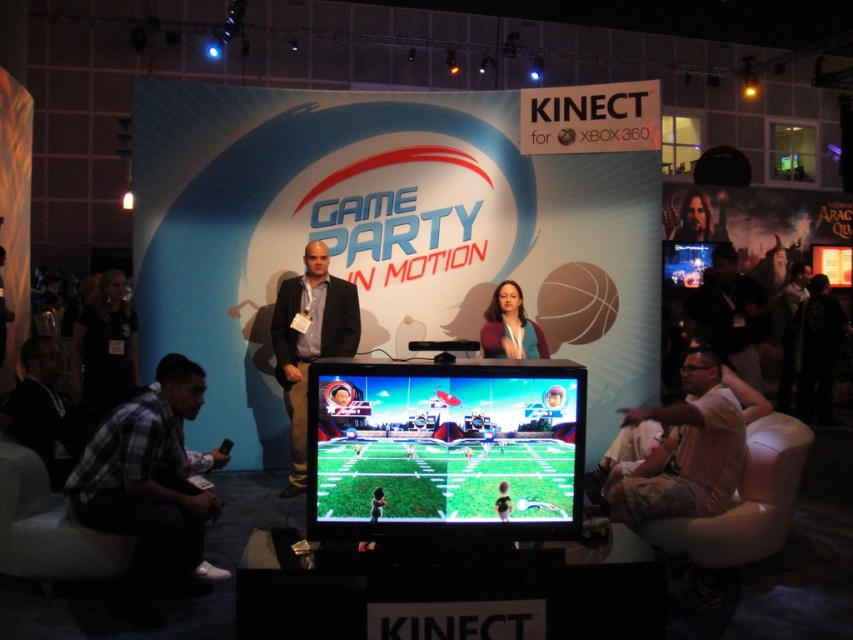
Can you confirm if matte black suit at center is taller than smooth skin face at upper right?

Correct, matte black suit at center is much taller as smooth skin face at upper right.

Who is positioned more to the left, matte black suit at center or smooth skin face at upper right?

Positioned to the left is matte black suit at center.

Locate an element on the screen. This screenshot has width=853, height=640. matte black suit at center is located at coordinates (309, 342).

Describe the element at coordinates (683, 451) in the screenshot. I see `white cotton shirt at right` at that location.

Can you confirm if white cotton shirt at right is smaller than matte blue shirt at center?

Actually, white cotton shirt at right might be larger than matte blue shirt at center.

This screenshot has width=853, height=640. I want to click on white cotton shirt at right, so click(683, 451).

Based on the photo, is plaid shirt at lower left behind matte black suit at center?

That is False.

Who is more distant from viewer, [134,442] or [357,336]?

Positioned behind is point [357,336].

In order to click on plaid shirt at lower left in this screenshot , I will do `click(148, 481)`.